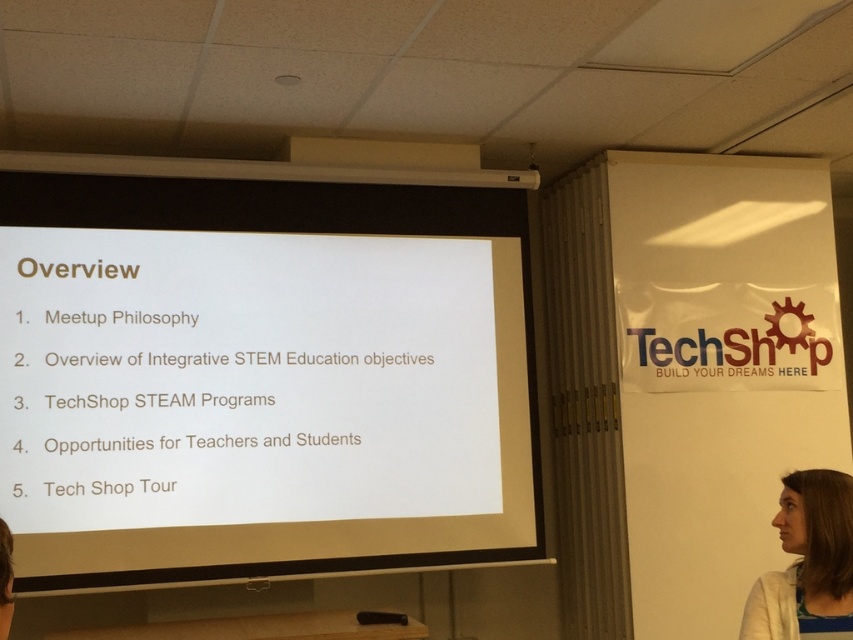
Question: Does white paper at center appear over white knitwear at lower right?

Choices:
 (A) no
 (B) yes

Answer: (B)

Question: Does white paper at center appear on the left side of white knitwear at lower right?

Choices:
 (A) yes
 (B) no

Answer: (A)

Question: Which point is closer to the camera taking this photo?

Choices:
 (A) (401, 330)
 (B) (740, 630)

Answer: (B)

Question: Is white paper at center thinner than white knitwear at lower right?

Choices:
 (A) no
 (B) yes

Answer: (A)

Question: Which point appears farthest from the camera in this image?

Choices:
 (A) (494, 532)
 (B) (809, 598)

Answer: (A)

Question: Which point is farther to the camera?

Choices:
 (A) (796, 566)
 (B) (0, 321)

Answer: (B)